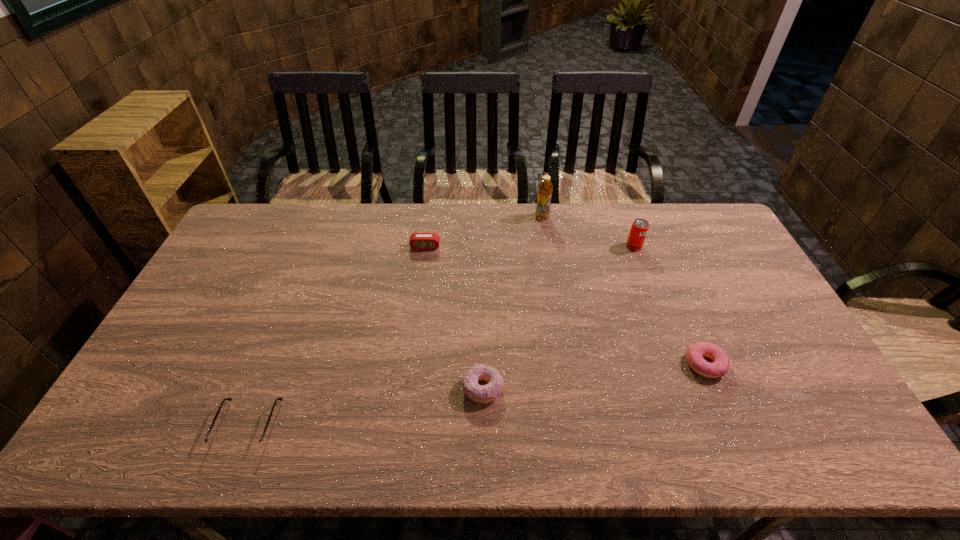
Find the location of a particular element. The width and height of the screenshot is (960, 540). empty space that is in between the can and the fourth object from right to left is located at coordinates (559, 318).

I want to click on free spot between the spectacles and the fifth object from right to left, so click(337, 336).

At what (x,y) coordinates should I click in order to perform the action: click on free space between the third object from right to left and the can. Please return your answer as a coordinate pair (x, y). The image size is (960, 540). Looking at the image, I should click on pyautogui.click(x=588, y=232).

Locate an element on the screen. The width and height of the screenshot is (960, 540). vacant space that is in between the right doughnut and the third object from right to left is located at coordinates (623, 291).

Where is `free spot between the can and the alarm clock`? The height and width of the screenshot is (540, 960). free spot between the can and the alarm clock is located at coordinates (530, 247).

Locate an element on the screen. The height and width of the screenshot is (540, 960). free space between the alarm clock and the fifth shortest object is located at coordinates (530, 247).

The image size is (960, 540). I want to click on vacant area that lies between the shorter doughnut and the taller doughnut, so click(x=593, y=376).

The width and height of the screenshot is (960, 540). What are the coordinates of `free space between the spectacles and the left doughnut` in the screenshot? It's located at coord(366,407).

This screenshot has height=540, width=960. In order to click on vacant space in between the second tallest object and the bottle in this screenshot , I will do `click(588, 232)`.

What are the coordinates of `empty space that is in between the can and the second object from left to right` in the screenshot? It's located at (530, 247).